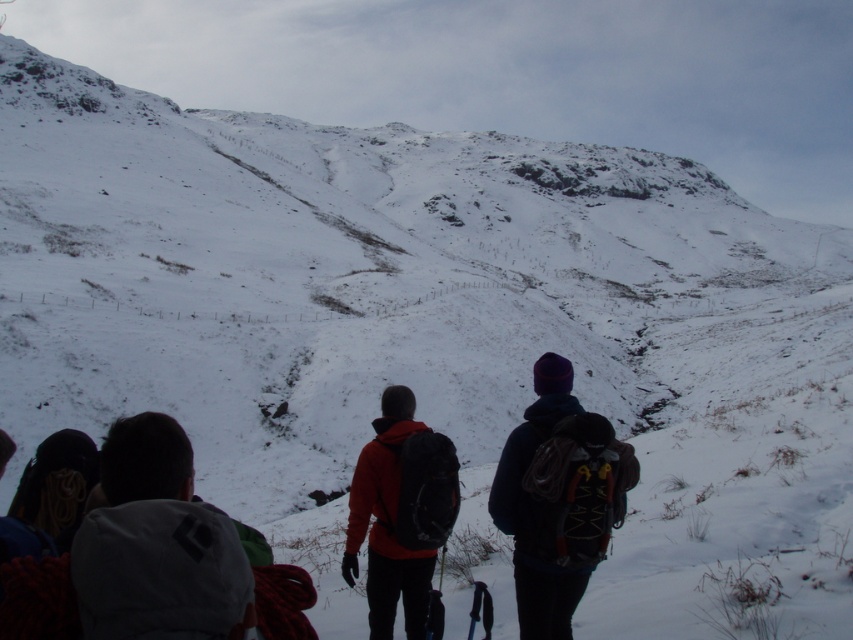
You are part of a hiking group and need to locate your friend wearing the matte orange jacket at center. From your current position at the white fleece jacket at lower left, which direction should you move to find them?

The white fleece jacket at lower left is positioned over the matte orange jacket at center, so you should move downward from the white fleece jacket at lower left to locate the matte orange jacket at center.